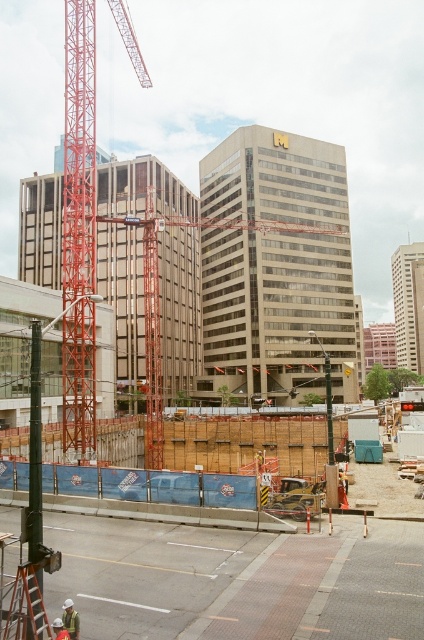
Is red painted metal tower crane at left positioned at the back of orange metallic crane at center?

Yes.

Can you confirm if red painted metal tower crane at left is shorter than orange metallic crane at center?

No, red painted metal tower crane at left is not shorter than orange metallic crane at center.

You are a GUI agent. You are given a task and a screenshot of the screen. Output one action in this format:
    pyautogui.click(x=<x>, y=<y>)
    Task: Click on the red painted metal tower crane at left
    This screenshot has height=640, width=424.
    Given the screenshot: What is the action you would take?
    pyautogui.click(x=78, y=228)

Where is `red painted metal tower crane at left`? The height and width of the screenshot is (640, 424). red painted metal tower crane at left is located at coordinates (78, 228).

Looking at this image, is orange metallic crane at center closer to the viewer compared to white hard hat at lower left?

No, it is behind white hard hat at lower left.

Is orange metallic crane at center below white hard hat at lower left?

Incorrect, orange metallic crane at center is not positioned below white hard hat at lower left.

Does point (78, 218) lie in front of point (70, 616)?

That is False.

This screenshot has height=640, width=424. Identify the location of orange metallic crane at center. (153, 282).

Does point (123, 630) come behind point (63, 612)?

Yes.

Is brown wooden fence at center closer to camera compared to white hard hat at lower left?

That is False.

Measure the distance between point [220,573] and camera.

Point [220,573] is 59.51 feet away from camera.

You are a GUI agent. You are given a task and a screenshot of the screen. Output one action in this format:
    pyautogui.click(x=<x>, y=<y>)
    Task: Click on the brown wooden fence at center
    
    Given the screenshot: What is the action you would take?
    pyautogui.click(x=237, y=579)